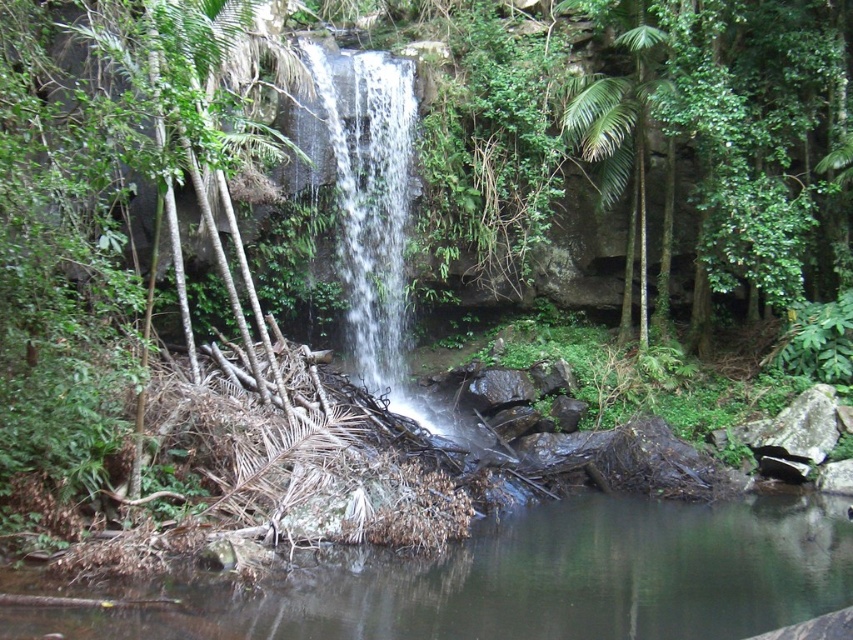
You are standing at the edge of the waterfall in the image and want to place a small statue on the green mossy log at lower center. The coordinates given are point (535, 580). Can you confirm if this point is indeed where the green mossy log is located?

Yes, according to the provided coordinates, point (535, 580) corresponds to the green mossy log at lower center, so placing the statue there would be accurate.

From the picture: You are a hiker who wants to cross the stream using the green mossy log at lower center. The water level is currently at the clear water at center. Is the log tall enough to stay above the water and be safe to walk on?

The green mossy log at lower center has a lesser height compared to clear water at center, so the log is shorter than the water level. This means the log is submerged in the water and not safe to walk on.

You are a hiker who wants to cross the river near the waterfall. You see the green mossy log at lower center. Can you use it as a bridge to cross the river?

The green mossy log at lower center is located at point (535, 580), so yes, you can use it as a bridge to cross the river.